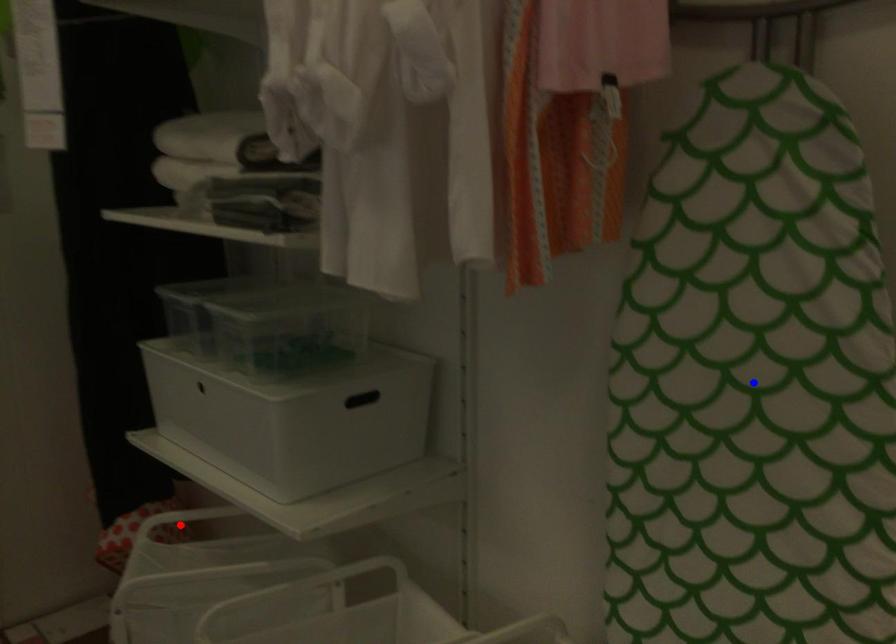
Question: Two points are marked on the image. Which point is closer to the camera?

Choices:
 (A) Blue point is closer.
 (B) Red point is closer.

Answer: (A)